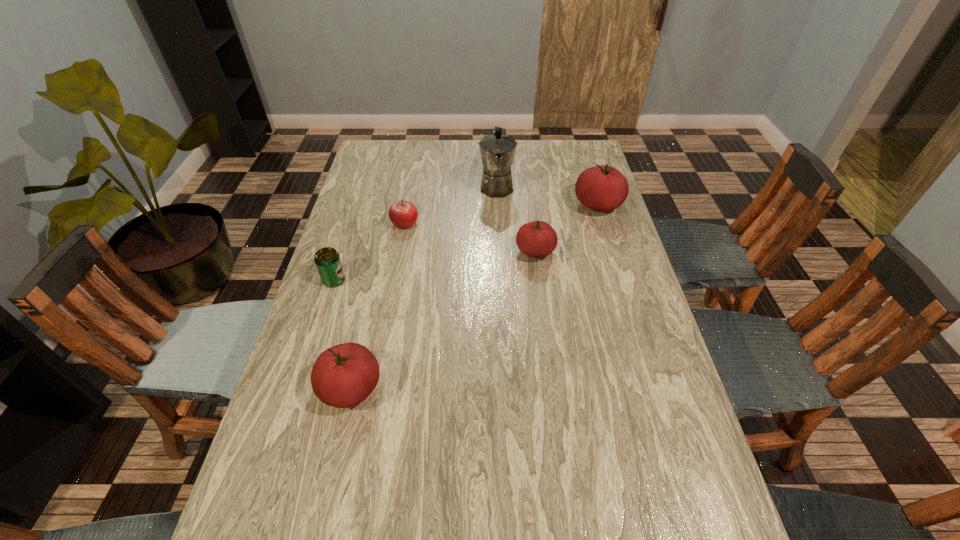
At what (x,y) coordinates should I click in order to perform the action: click on blank space located 0.180m on the back of the leftmost tomato. Please return your answer as a coordinate pair (x, y). Looking at the image, I should click on click(370, 305).

This screenshot has width=960, height=540. In order to click on free space located 0.160m on the back of the shortest tomato in this screenshot , I will do `click(530, 207)`.

Identify the location of vacant space positioned on the back of the rightmost object. This screenshot has height=540, width=960. (588, 172).

This screenshot has height=540, width=960. In order to click on free region located 0.360m on the pouring side of the tallest object in this screenshot , I will do `click(501, 278)`.

The image size is (960, 540). Identify the location of vacant space located on the right of the apple. (437, 223).

This screenshot has width=960, height=540. I want to click on blank space located on the right of the leftmost object, so click(x=464, y=280).

You are a GUI agent. You are given a task and a screenshot of the screen. Output one action in this format:
    pyautogui.click(x=<x>, y=<y>)
    Task: Click on the object located in the far edge section of the desktop
    Image resolution: width=960 pixels, height=540 pixels.
    Given the screenshot: What is the action you would take?
    pyautogui.click(x=497, y=151)

The height and width of the screenshot is (540, 960). I want to click on tomato that is at the left edge, so click(x=344, y=375).

Locate an element on the screen. apple at the left edge is located at coordinates (403, 214).

Image resolution: width=960 pixels, height=540 pixels. In order to click on beer can positioned at the left edge in this screenshot , I will do `click(327, 260)`.